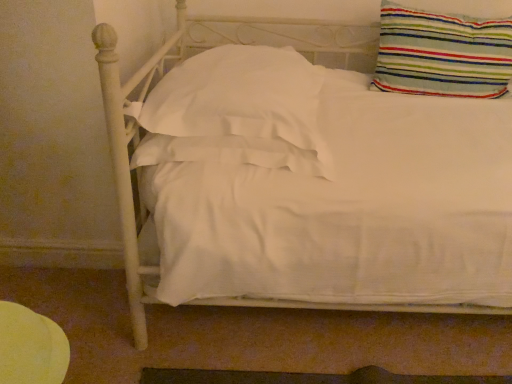
Question: Based on their positions, is white satin pillow at center, arranged as the 2th pillow when viewed from the right, located to the left or right of striped fabric pillow at upper right, the second pillow viewed from the left?

Choices:
 (A) right
 (B) left

Answer: (B)

Question: In terms of width, does white satin pillow at center, arranged as the 2th pillow when viewed from the right, look wider or thinner when compared to striped fabric pillow at upper right, the 1th pillow viewed from the right?

Choices:
 (A) wide
 (B) thin

Answer: (A)

Question: From the image's perspective, is white satin pillow at center, which is the 1th pillow from left to right, located above or below striped fabric pillow at upper right, the 1th pillow viewed from the right?

Choices:
 (A) above
 (B) below

Answer: (B)

Question: From a real-world perspective, is striped fabric pillow at upper right, the second pillow viewed from the left, above or below white satin pillow at center, which is the 1th pillow from left to right?

Choices:
 (A) above
 (B) below

Answer: (A)

Question: Considering the positions of striped fabric pillow at upper right, the 1th pillow viewed from the right, and white satin pillow at center, arranged as the 2th pillow when viewed from the right, in the image, is striped fabric pillow at upper right, the 1th pillow viewed from the right, bigger or smaller than white satin pillow at center, arranged as the 2th pillow when viewed from the right,?

Choices:
 (A) big
 (B) small

Answer: (B)

Question: In terms of height, does striped fabric pillow at upper right, the second pillow viewed from the left, look taller or shorter compared to white satin pillow at center, which is the 1th pillow from left to right?

Choices:
 (A) tall
 (B) short

Answer: (A)

Question: Is striped fabric pillow at upper right, the second pillow viewed from the left, to the left or to the right of white satin pillow at center, which is the 1th pillow from left to right, in the image?

Choices:
 (A) left
 (B) right

Answer: (B)